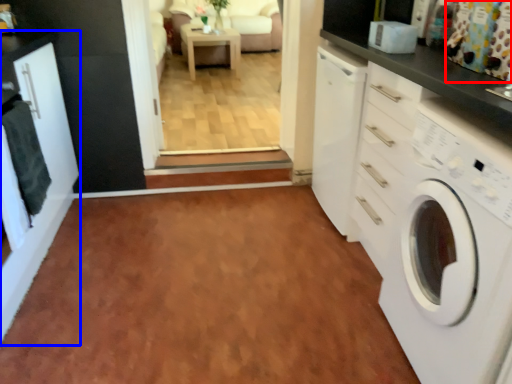
Question: Which point is further to the camera, curtain (highlighted by a red box) or cabinetry (highlighted by a blue box)?

Choices:
 (A) curtain
 (B) cabinetry

Answer: (A)